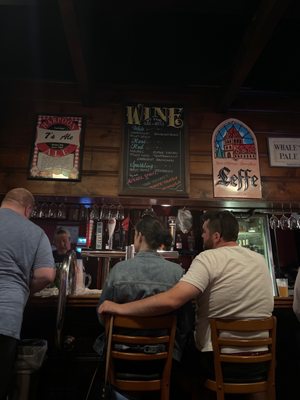
The image size is (300, 400). Identify the location of wall sign. (232, 189), (275, 155), (53, 163), (150, 122).